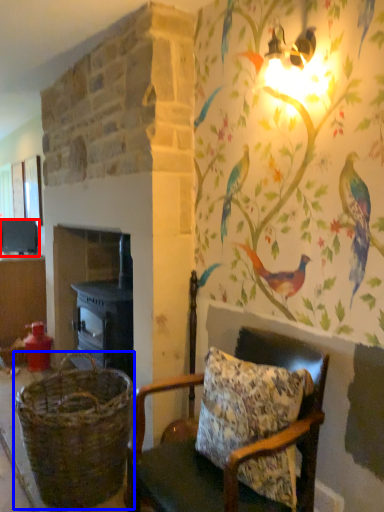
Question: Which point is closer to the camera, appliance (highlighted by a red box) or basket (highlighted by a blue box)?

Choices:
 (A) appliance
 (B) basket

Answer: (B)